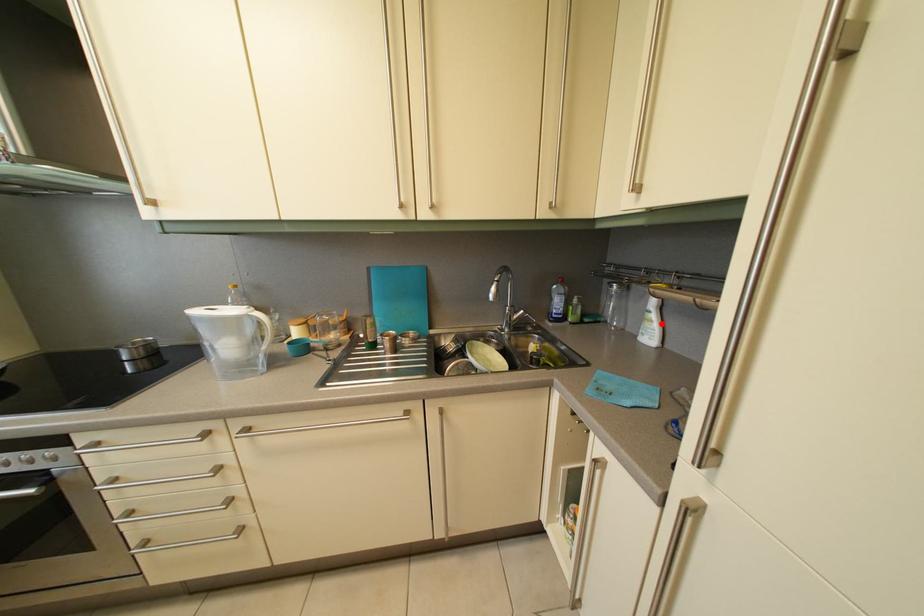
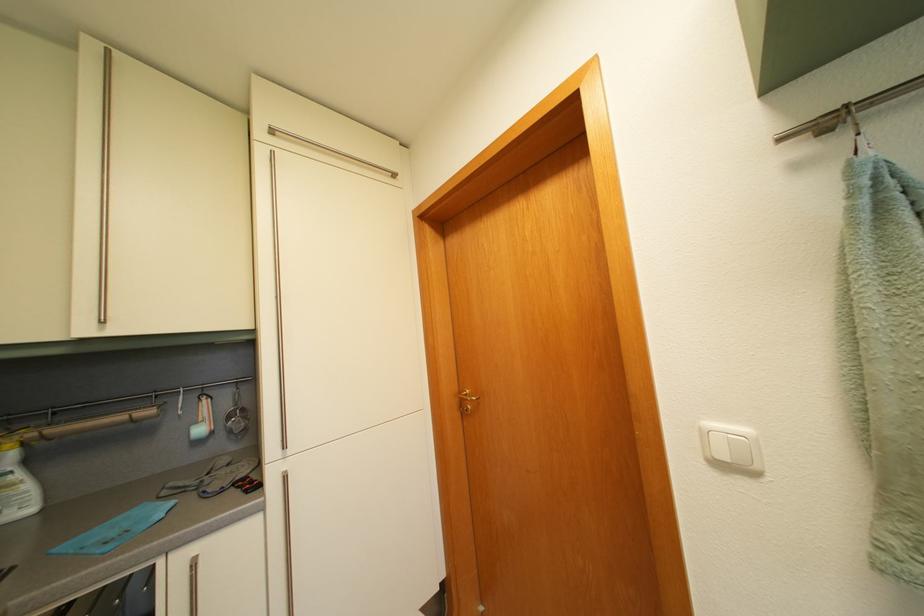
Locate, in the second image, the point that corresponds to the highlighted location in the first image.

(26, 484)